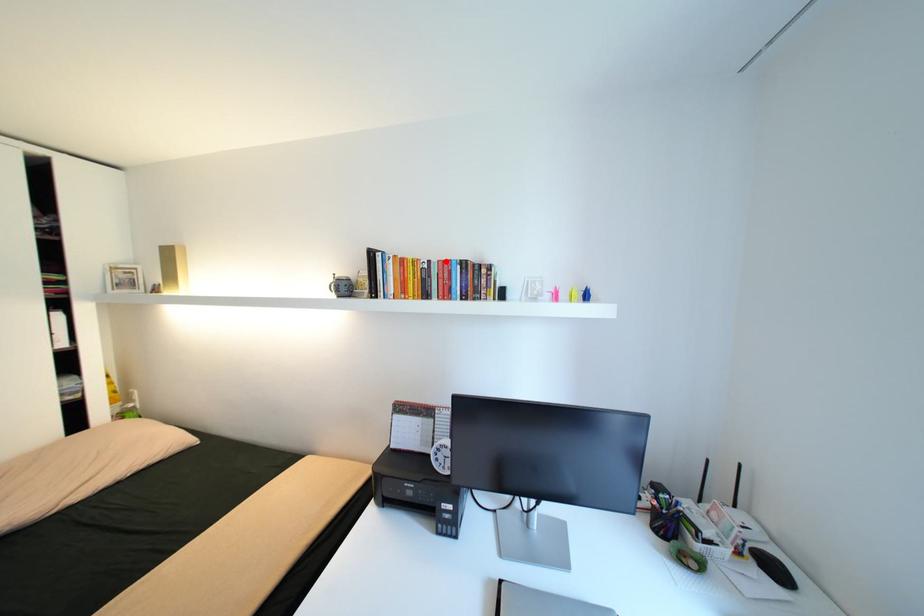
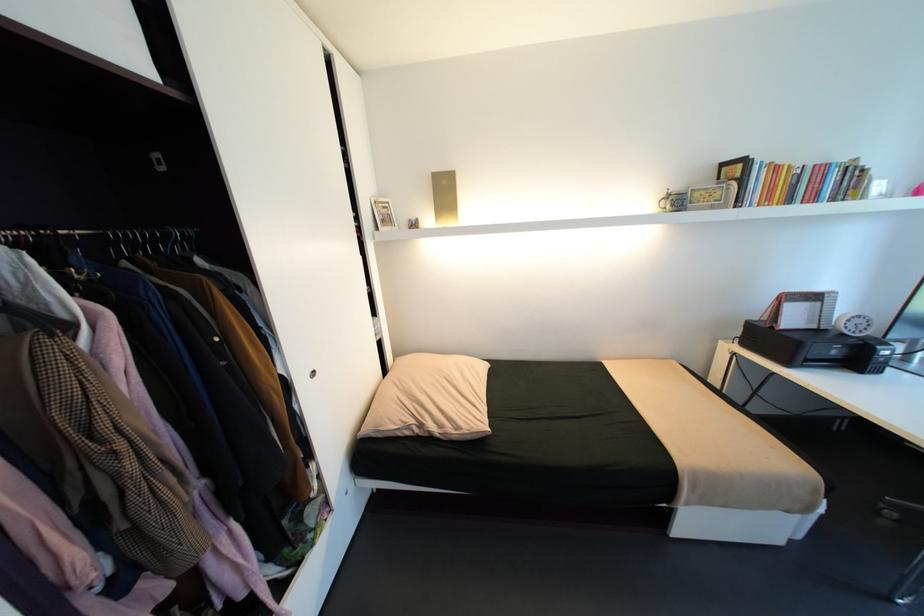
Locate, in the second image, the point that corresponds to the highlighted location in the first image.

(821, 166)